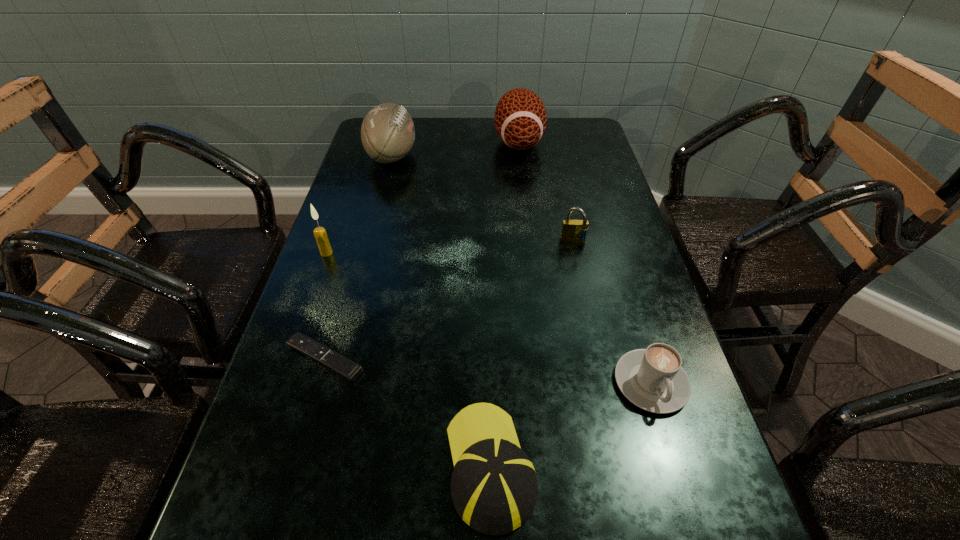
Identify the location of blank area in the image that satisfies the following two spatial constraints: 1. with the brim of the right football (American) facing forward; 2. on the left side of the baseball cap. (485, 142).

Where is `free point that satisfies the following two spatial constraints: 1. on the front side of the remote control; 2. on the right side of the fourth farthest object`? This screenshot has height=540, width=960. free point that satisfies the following two spatial constraints: 1. on the front side of the remote control; 2. on the right side of the fourth farthest object is located at coordinates (289, 358).